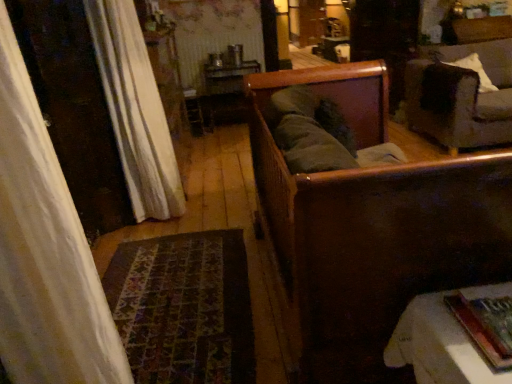
Describe the element at coordinates (135, 110) in the screenshot. This screenshot has width=512, height=384. I see `white textured curtain at left` at that location.

Locate an element on the screen. Image resolution: width=512 pixels, height=384 pixels. white textured curtain at left is located at coordinates (x=135, y=110).

Find the location of a particular element. The height and width of the screenshot is (384, 512). wooden sofa at center, the 1th furniture positioned from the front is located at coordinates (372, 227).

At what (x,y) coordinates should I click in order to perform the action: click on white fabric tablecloth at lower right, the second furniture positioned from the front. Please return your answer as a coordinate pair (x, y). The width and height of the screenshot is (512, 384). Looking at the image, I should click on (438, 346).

From a real-world perspective, who is located higher, white textured curtain at left or white soft pillow at upper right?

In real-world perspective, white soft pillow at upper right is above.

Relative to white soft pillow at upper right, is white textured curtain at left in front or behind?

In the image, white textured curtain at left appears in front of white soft pillow at upper right.

Between white textured curtain at left and white soft pillow at upper right, which one has larger width?

Wider between the two is white soft pillow at upper right.

Consider the image. Would you say white textured curtain at left contains white fabric tablecloth at lower right, which is the 1th furniture from back to front?

No, white fabric tablecloth at lower right, which is the 1th furniture from back to front, is not surrounded by white textured curtain at left.

Is white textured curtain at left turned away from white fabric tablecloth at lower right, which is the 1th furniture from back to front?

No, white textured curtain at left is not facing the opposite direction of white fabric tablecloth at lower right, which is the 1th furniture from back to front.

Can you confirm if white textured curtain at left is smaller than white fabric tablecloth at lower right, the second furniture positioned from the front?

No, white textured curtain at left is not smaller than white fabric tablecloth at lower right, the second furniture positioned from the front.

How many degrees apart are the facing directions of white fabric tablecloth at lower right, the second furniture positioned from the front, and hardcover book at lower right?

The angular difference between white fabric tablecloth at lower right, the second furniture positioned from the front, and hardcover book at lower right is 1.37 degrees.

Is white fabric tablecloth at lower right, which is the 1th furniture from back to front, positioned with its back to hardcover book at lower right?

white fabric tablecloth at lower right, which is the 1th furniture from back to front, does not have its back to hardcover book at lower right.

Considering the relative sizes of white fabric tablecloth at lower right, which is the 1th furniture from back to front, and hardcover book at lower right in the image provided, is white fabric tablecloth at lower right, which is the 1th furniture from back to front, smaller than hardcover book at lower right?

Actually, white fabric tablecloth at lower right, which is the 1th furniture from back to front, might be larger than hardcover book at lower right.

Where is `book above the white fabric tablecloth at lower right, the second furniture positioned from the front (from the image's perspective)`? book above the white fabric tablecloth at lower right, the second furniture positioned from the front (from the image's perspective) is located at coordinates (477, 334).

In the scene shown: Is white textured curtain at left situated inside hardcover book at lower right or outside?

white textured curtain at left is outside hardcover book at lower right.

Does white textured curtain at left lie behind hardcover book at lower right?

Yes, the depth of white textured curtain at left is greater than that of hardcover book at lower right.

From the image's perspective, which one is positioned lower, white textured curtain at left or hardcover book at lower right?

From the image's view, hardcover book at lower right is below.

Which object is wider, white textured curtain at left or hardcover book at lower right?

hardcover book at lower right is wider.

From a real-world perspective, does white soft pillow at upper right sit lower than white fabric tablecloth at lower right, which is the 1th furniture from back to front?

No, from a real-world perspective, white soft pillow at upper right is not below white fabric tablecloth at lower right, which is the 1th furniture from back to front.

Is white soft pillow at upper right positioned before white fabric tablecloth at lower right, the second furniture positioned from the front?

No, white soft pillow at upper right is behind white fabric tablecloth at lower right, the second furniture positioned from the front.

In terms of size, does white soft pillow at upper right appear bigger or smaller than white fabric tablecloth at lower right, which is the 1th furniture from back to front?

white soft pillow at upper right is bigger than white fabric tablecloth at lower right, which is the 1th furniture from back to front.

This screenshot has width=512, height=384. Find the location of `studio couch above the white textured curtain at left (from the image's perspective)`. studio couch above the white textured curtain at left (from the image's perspective) is located at coordinates (461, 96).

Is white textured curtain at left positioned with its back to dark gray fabric couch at upper right?

No.

From the image's perspective, which is below, white textured curtain at left or dark gray fabric couch at upper right?

white textured curtain at left, from the image's perspective.

How much distance is there between hardcover book at lower right and white textured curtain at left?

They are 2.13 meters apart.

Is hardcover book at lower right positioned far away from white textured curtain at left?

Yes, hardcover book at lower right and white textured curtain at left are quite far apart.

Considering the relative positions of hardcover book at lower right and white textured curtain at left in the image provided, is hardcover book at lower right to the right of white textured curtain at left from the viewer's perspective?

Indeed, hardcover book at lower right is positioned on the right side of white textured curtain at left.

You are a GUI agent. You are given a task and a screenshot of the screen. Output one action in this format:
    pyautogui.click(x=<x>, y=<y>)
    Task: Click on the curtain that appears below the white soft pillow at upper right (from a real-world perspective)
    
    Given the screenshot: What is the action you would take?
    pyautogui.click(x=135, y=110)

Where is `curtain above the white fabric tablecloth at lower right, the second furniture positioned from the front (from the image's perspective)`? The image size is (512, 384). curtain above the white fabric tablecloth at lower right, the second furniture positioned from the front (from the image's perspective) is located at coordinates (135, 110).

Which object lies further to the anchor point wooden sofa at center, positioned as the second furniture in back-to-front order, white textured curtain at left or white soft pillow at upper right?

Based on the image, white soft pillow at upper right appears to be further to wooden sofa at center, positioned as the second furniture in back-to-front order.

When comparing their distances from dark gray fabric couch at upper right, does hardcover book at lower right or wooden sofa at center, the 1th furniture positioned from the front, seem further?

Based on the image, hardcover book at lower right appears to be further to dark gray fabric couch at upper right.

Considering their positions, is white fabric tablecloth at lower right, which is the 1th furniture from back to front, positioned further to white soft pillow at upper right than dark gray fabric couch at upper right?

Among the two, white fabric tablecloth at lower right, which is the 1th furniture from back to front, is located further to white soft pillow at upper right.

From the image, which object appears to be farther from wooden sofa at center, the 1th furniture positioned from the front, white fabric tablecloth at lower right, which is the 1th furniture from back to front, or dark gray fabric couch at upper right?

dark gray fabric couch at upper right.

Considering their positions, is white textured curtain at left positioned further to hardcover book at lower right than white soft pillow at upper right?

white soft pillow at upper right lies further to hardcover book at lower right than the other object.

From the picture: Estimate the real-world distances between objects in this image. Which object is closer to white fabric tablecloth at lower right, which is the 1th furniture from back to front, dark gray fabric couch at upper right or wooden sofa at center, the 1th furniture positioned from the front?

wooden sofa at center, the 1th furniture positioned from the front, lies closer to white fabric tablecloth at lower right, which is the 1th furniture from back to front, than the other object.

Estimate the real-world distances between objects in this image. Which object is closer to white soft pillow at upper right, hardcover book at lower right or white fabric tablecloth at lower right, the second furniture positioned from the front?

white fabric tablecloth at lower right, the second furniture positioned from the front, lies closer to white soft pillow at upper right than the other object.

Based on the photo, looking at the image, which one is located closer to wooden sofa at center, the 1th furniture positioned from the front, hardcover book at lower right or white soft pillow at upper right?

Among the two, hardcover book at lower right is located nearer to wooden sofa at center, the 1th furniture positioned from the front.

Locate an element on the screen. This screenshot has width=512, height=384. studio couch located between white fabric tablecloth at lower right, which is the 1th furniture from back to front, and white soft pillow at upper right in the depth direction is located at coordinates (461, 96).

This screenshot has width=512, height=384. Identify the location of studio couch between hardcover book at lower right and white soft pillow at upper right in the front-back direction. (x=461, y=96).

This screenshot has height=384, width=512. Identify the location of book between wooden sofa at center, the 1th furniture positioned from the front, and white soft pillow at upper right in the front-back direction. (477, 334).

I want to click on book located between white textured curtain at left and dark gray fabric couch at upper right in the left-right direction, so click(x=477, y=334).